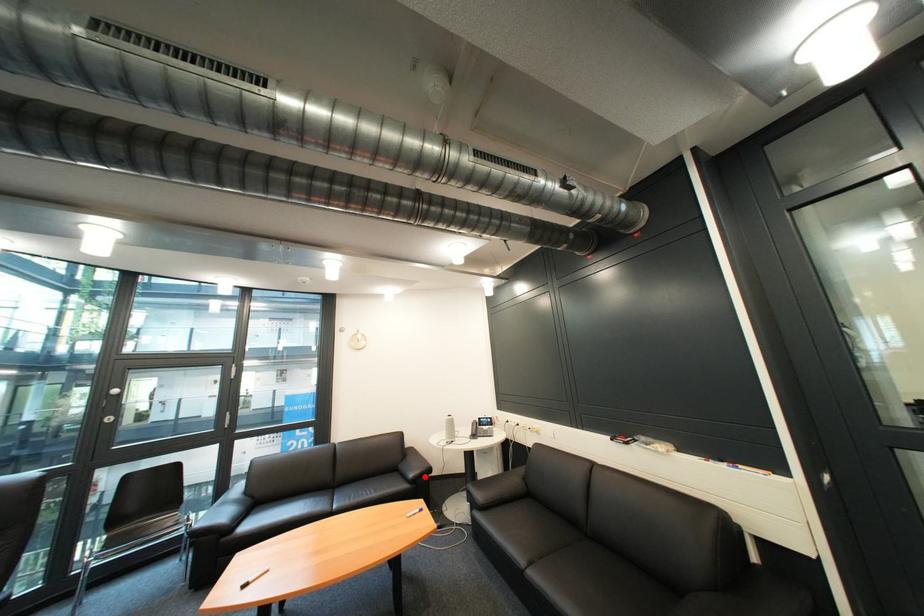
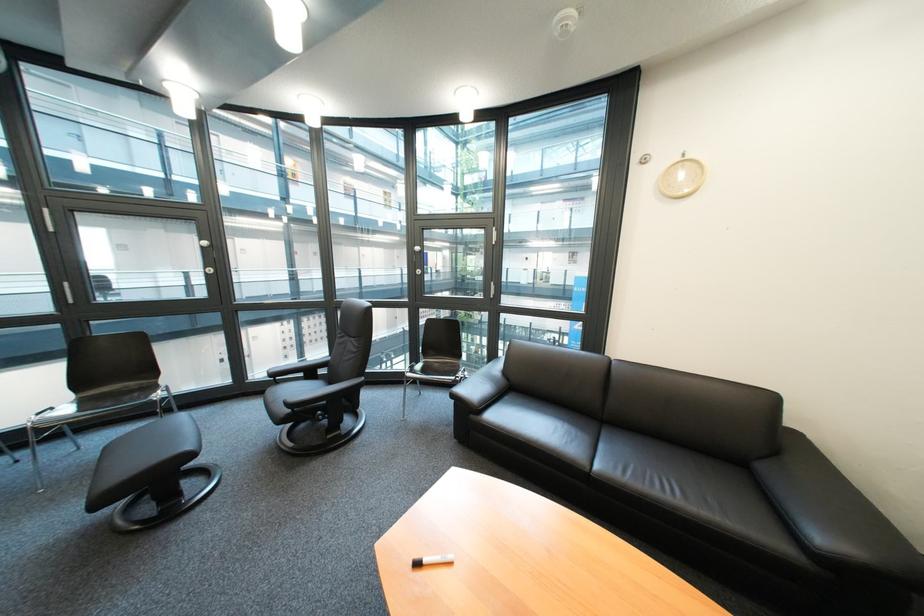
Question: I am providing you with two images of the same scene from different viewpoints. Image1 has a red point marked. In image2, the corresponding 3D location appears at what relative position? Reply with the corresponding letter.

Choices:
 (A) Closer
 (B) Farther

Answer: (A)